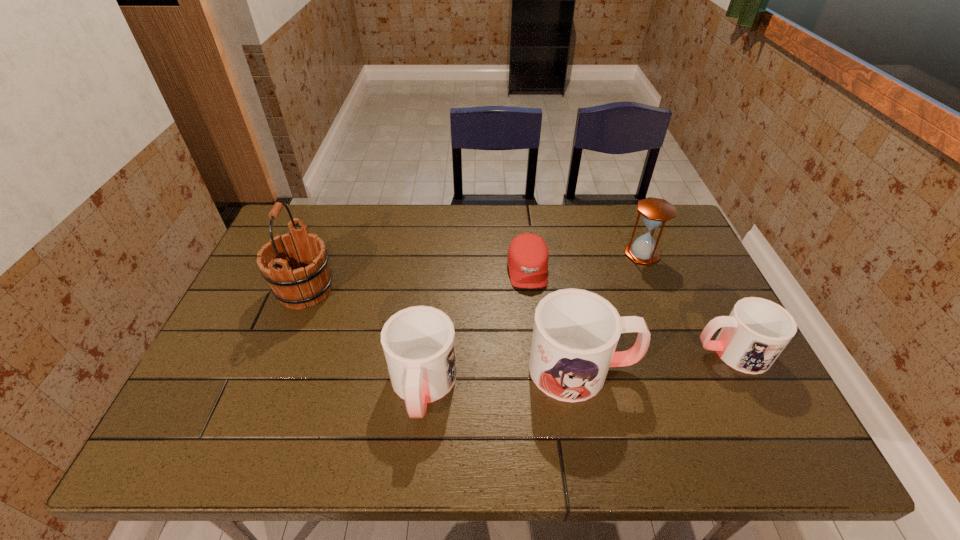
Identify the location of empty space between the second mug from left to right and the rightmost mug. tap(657, 360).

This screenshot has width=960, height=540. In order to click on vacant area that lies between the shortest mug and the hourglass in this screenshot , I will do `click(687, 303)`.

The image size is (960, 540). In order to click on vacant region between the tallest object and the cap in this screenshot , I will do `click(417, 280)`.

Where is `free spot between the rightmost mug and the leftmost object`? The height and width of the screenshot is (540, 960). free spot between the rightmost mug and the leftmost object is located at coordinates (518, 321).

I want to click on object that is the fourth nearest to the hourglass, so click(418, 342).

Point out which object is positioned as the second nearest to the leftmost mug. Please provide its 2D coordinates. Your answer should be formatted as a tuple, i.e. [(x, y)], where the tuple contains the x and y coordinates of a point satisfying the conditions above.

[(310, 282)]

Where is `mug that can be found as the second closest to the second mug from right to left`? This screenshot has width=960, height=540. mug that can be found as the second closest to the second mug from right to left is located at coordinates (418, 342).

Point out which mug is positioned as the third nearest to the hourglass. Please provide its 2D coordinates. Your answer should be formatted as a tuple, i.e. [(x, y)], where the tuple contains the x and y coordinates of a point satisfying the conditions above.

[(418, 342)]

Locate an element on the screen. free space that satisfies the following two spatial constraints: 1. on the side of the second mug from left to right with the handle; 2. on the side of the second shortest mug with the handle is located at coordinates (586, 386).